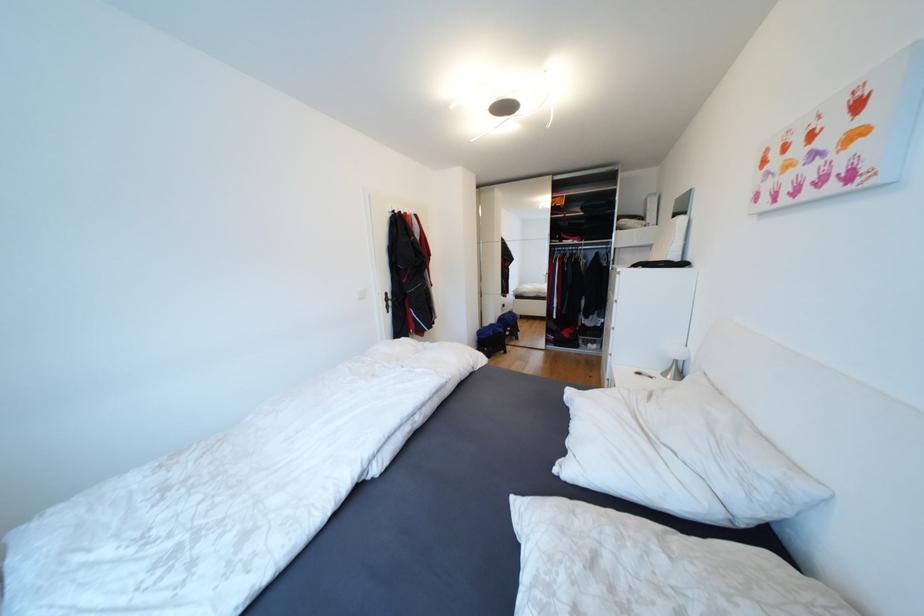
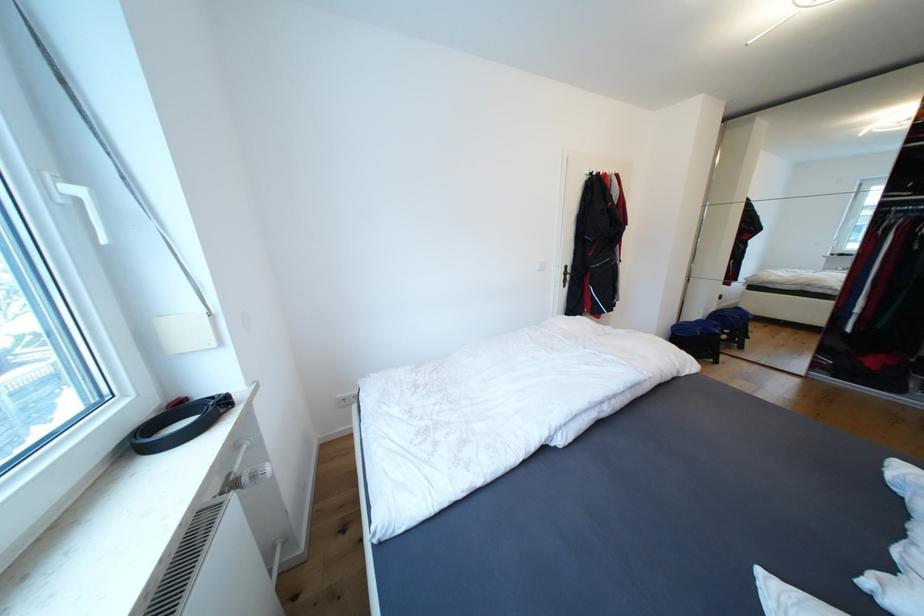
Question: Based on the continuous images, in which direction is the camera rotating? Reply with the corresponding letter.

Choices:
 (A) Left
 (B) Right
 (C) Up
 (D) Down

Answer: (A)